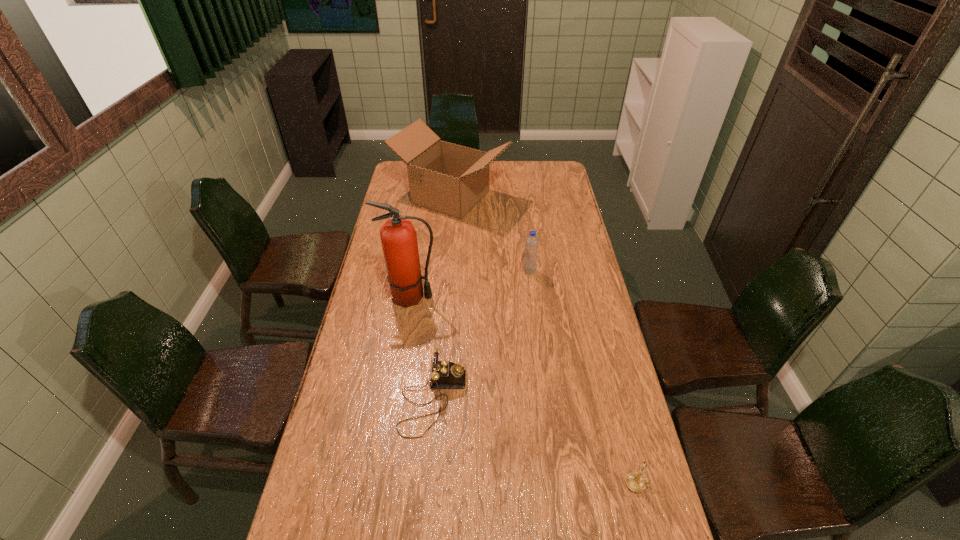
At what (x,y) coordinates should I click in order to perform the action: click on the tallest object. Please return your answer as a coordinate pair (x, y). This screenshot has height=540, width=960. Looking at the image, I should click on (398, 236).

Find the location of `fire extinguisher`. fire extinguisher is located at coordinates (398, 236).

You are a GUI agent. You are given a task and a screenshot of the screen. Output one action in this format:
    pyautogui.click(x=<x>, y=<y>)
    Task: Click on the fourth shortest object
    
    Given the screenshot: What is the action you would take?
    pyautogui.click(x=451, y=179)

You are a GUI agent. You are given a task and a screenshot of the screen. Output one action in this format:
    pyautogui.click(x=<x>, y=<y>)
    Task: Click on the box
    
    Given the screenshot: What is the action you would take?
    pyautogui.click(x=451, y=179)

I want to click on the third tallest object, so click(532, 242).

At what (x,y) coordinates should I click in order to perform the action: click on water bottle. Please return your answer as a coordinate pair (x, y). Looking at the image, I should click on (532, 242).

Find the location of a particular element. The height and width of the screenshot is (540, 960). candle holder is located at coordinates (635, 482).

This screenshot has width=960, height=540. In order to click on the nearest object in this screenshot , I will do `click(635, 482)`.

Locate an element on the screen. telephone is located at coordinates (444, 374).

Where is `blank space located 0.280m on the nozzle of the tallest object`? blank space located 0.280m on the nozzle of the tallest object is located at coordinates (515, 297).